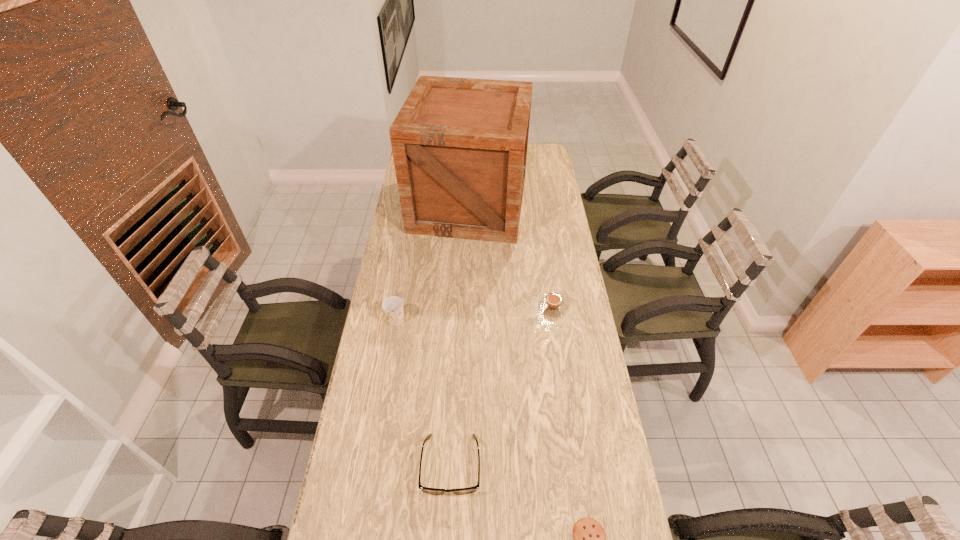
Locate an element on the screen. The width and height of the screenshot is (960, 540). the closest object to the cookie is located at coordinates (435, 491).

Where is `the closest object relative to the tallest object`? This screenshot has width=960, height=540. the closest object relative to the tallest object is located at coordinates (553, 304).